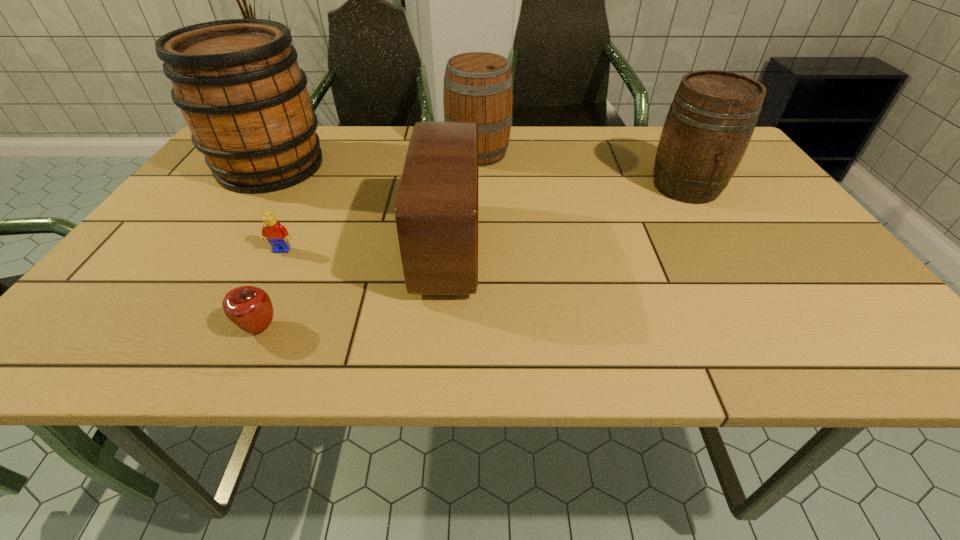
You are a GUI agent. You are given a task and a screenshot of the screen. Output one action in this format:
    pyautogui.click(x=<x>, y=<y>)
    Task: Click on the vacant space at the right edge of the desktop
    This screenshot has width=960, height=540.
    Given the screenshot: What is the action you would take?
    pyautogui.click(x=814, y=276)

Locate an element on the screen. Image resolution: width=960 pixels, height=540 pixels. free point between the radio receiver and the tallest object is located at coordinates (359, 207).

Where is `unoccupied position between the radio receiver and the tallest cider`? unoccupied position between the radio receiver and the tallest cider is located at coordinates (359, 207).

I want to click on empty location between the Lego and the rightmost cider, so click(484, 218).

Image resolution: width=960 pixels, height=540 pixels. What are the coordinates of `empty space between the leftmost cider and the nearest object` in the screenshot? It's located at (265, 247).

This screenshot has width=960, height=540. Find the location of `free point between the second cider from left to right and the apple`. free point between the second cider from left to right and the apple is located at coordinates coord(369,241).

Locate an element on the screen. free space between the second cider from right to left and the rightmost cider is located at coordinates (582, 170).

Find the location of a particular element. vacant area that lies between the Lego and the tallest object is located at coordinates (276, 208).

I want to click on vacant space in between the radio receiver and the rightmost cider, so tap(567, 217).

Choose which object is the nearest neighbor to the apple. Please provide its 2D coordinates. Your answer should be formatted as a tuple, i.e. [(x, y)], where the tuple contains the x and y coordinates of a point satisfying the conditions above.

[(276, 234)]